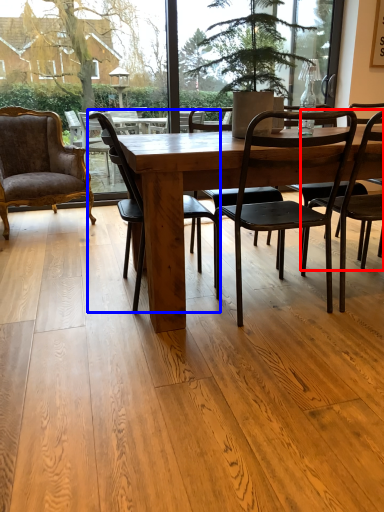
Question: Which of the following is the farthest to the observer, chair (highlighted by a red box) or chair (highlighted by a blue box)?

Choices:
 (A) chair
 (B) chair

Answer: (B)